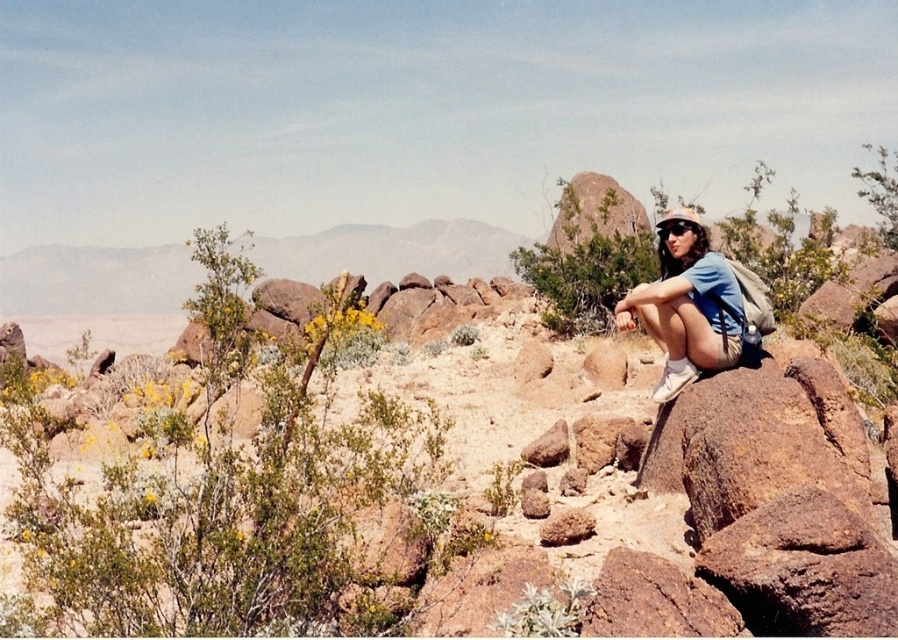
Question: Observing the image, what is the correct spatial positioning of green leafy bush at left in reference to blue fabric shirt at center?

Choices:
 (A) below
 (B) above

Answer: (B)

Question: Which object is positioned closest to the green leafy bush at center?

Choices:
 (A) blue fabric shirt at center
 (B) green leafy bush at left

Answer: (A)

Question: Is green leafy bush at left below green leafy bush at center?

Choices:
 (A) no
 (B) yes

Answer: (B)

Question: Which of the following is the farthest from the observer?

Choices:
 (A) [x=612, y=184]
 (B) [x=254, y=460]

Answer: (A)

Question: Where is green leafy bush at center located in relation to blue fabric shirt at center in the image?

Choices:
 (A) left
 (B) right

Answer: (B)

Question: Which object is farther from the camera taking this photo?

Choices:
 (A) green leafy bush at center
 (B) green leafy bush at left
 (C) blue fabric shirt at center

Answer: (A)